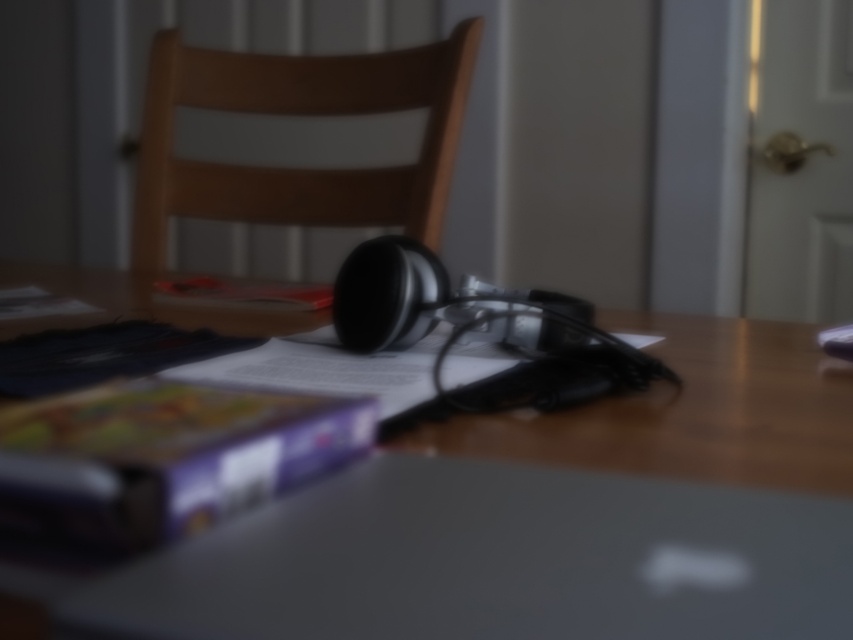
Question: Is wooden table at center below sleek matte laptop at center?

Choices:
 (A) no
 (B) yes

Answer: (A)

Question: Can you confirm if wooden table at center is positioned above sleek matte laptop at center?

Choices:
 (A) yes
 (B) no

Answer: (A)

Question: Observing the image, what is the correct spatial positioning of wooden table at center in reference to sleek matte laptop at center?

Choices:
 (A) left
 (B) right

Answer: (B)

Question: Estimate the real-world distances between objects in this image. Which object is closer to the wooden chair at center?

Choices:
 (A) wooden table at center
 (B) sleek matte laptop at center

Answer: (A)

Question: Based on their relative distances, which object is farther from the sleek matte laptop at center?

Choices:
 (A) wooden table at center
 (B) wooden chair at center

Answer: (B)

Question: Which object is the closest to the wooden chair at center?

Choices:
 (A) wooden table at center
 (B) sleek matte laptop at center

Answer: (A)